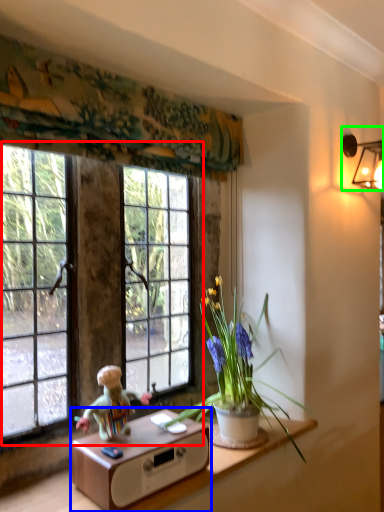
Question: Estimate the real-world distances between objects in this image. Which object is closer to window (highlighted by a red box), table (highlighted by a blue box) or lamp (highlighted by a green box)?

Choices:
 (A) table
 (B) lamp

Answer: (A)